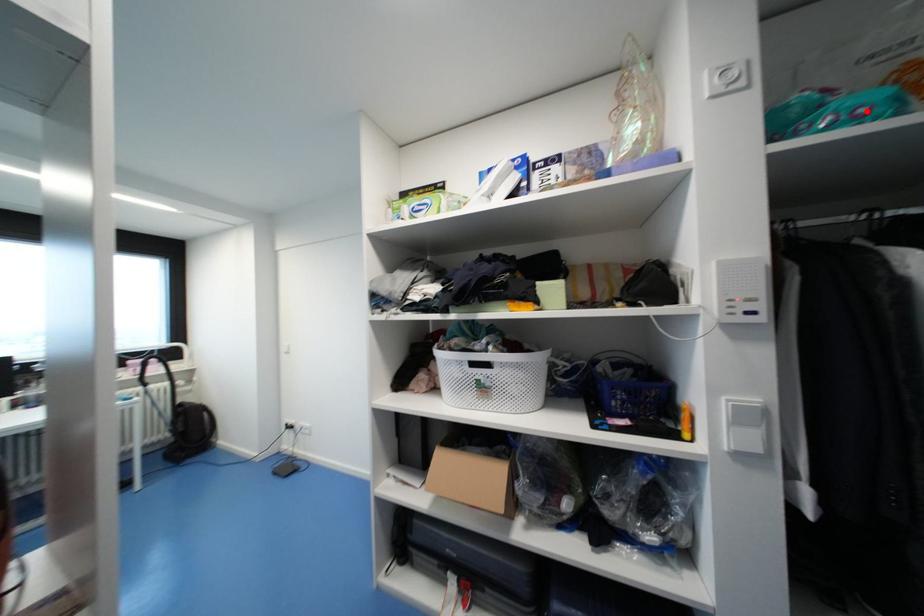
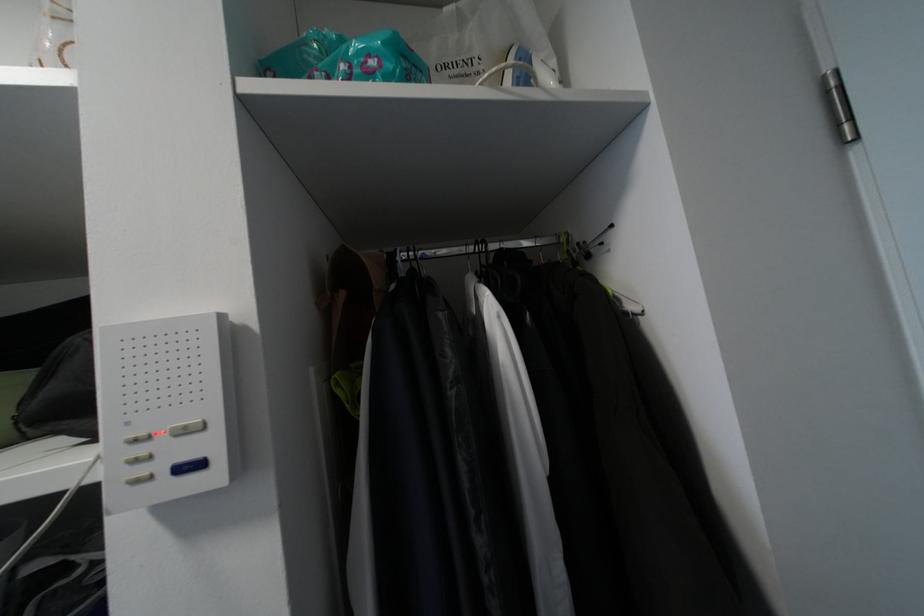
Question: A red point is marked in image1. In image2, is the corresponding 3D point closer to the camera or farther? Reply with the corresponding letter.

Choices:
 (A) The corresponding 3D point is closer.
 (B) The corresponding 3D point is farther.

Answer: (A)